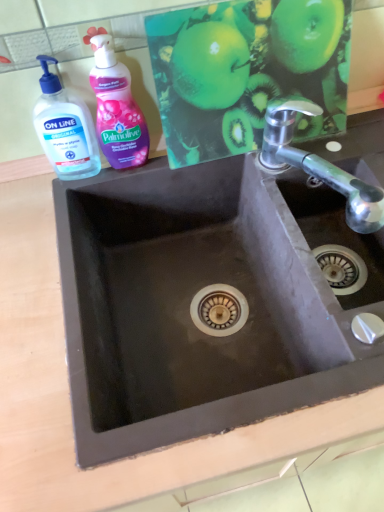
Question: Is green matte apple at upper center not close to black matte sink at center?

Choices:
 (A) no
 (B) yes

Answer: (A)

Question: Can you confirm if green matte apple at upper center is smaller than black matte sink at center?

Choices:
 (A) yes
 (B) no

Answer: (A)

Question: Considering the relative positions of green matte apple at upper center and black matte sink at center in the image provided, is green matte apple at upper center to the left of black matte sink at center from the viewer's perspective?

Choices:
 (A) yes
 (B) no

Answer: (A)

Question: From the image's perspective, is green matte apple at upper center below black matte sink at center?

Choices:
 (A) no
 (B) yes

Answer: (A)

Question: From a real-world perspective, is green matte apple at upper center physically above black matte sink at center?

Choices:
 (A) yes
 (B) no

Answer: (A)

Question: Is green matte apple at upper center not inside black matte sink at center?

Choices:
 (A) yes
 (B) no

Answer: (A)

Question: From a real-world perspective, is black matte sink at center on top of polished chrome tap at upper right?

Choices:
 (A) no
 (B) yes

Answer: (A)

Question: Is the depth of black matte sink at center less than that of polished chrome tap at upper right?

Choices:
 (A) no
 (B) yes

Answer: (B)

Question: From a real-world perspective, is black matte sink at center located beneath polished chrome tap at upper right?

Choices:
 (A) no
 (B) yes

Answer: (B)

Question: Can you confirm if black matte sink at center is taller than polished chrome tap at upper right?

Choices:
 (A) no
 (B) yes

Answer: (B)

Question: Considering the relative sizes of black matte sink at center and polished chrome tap at upper right in the image provided, is black matte sink at center thinner than polished chrome tap at upper right?

Choices:
 (A) no
 (B) yes

Answer: (A)

Question: Is black matte sink at center next to polished chrome tap at upper right and touching it?

Choices:
 (A) no
 (B) yes

Answer: (A)

Question: From the image's perspective, is transparent plastic hand soap at upper left over green matte apple at upper center?

Choices:
 (A) yes
 (B) no

Answer: (B)